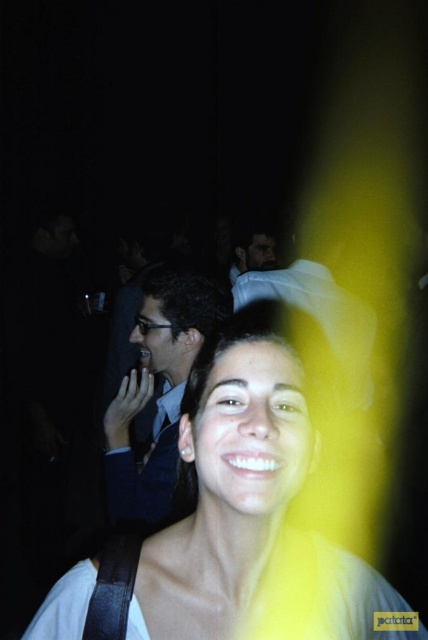
Is white matte face at center in front of matte white shirt at center?

Yes, it is.

Which of these two, white matte face at center or matte white shirt at center, stands taller?

Standing taller between the two is white matte face at center.

The image size is (428, 640). I want to click on white matte face at center, so click(x=231, y=522).

Consider the image. Between white matte face at center and matte black suit at center, which one appears on the left side from the viewer's perspective?

From the viewer's perspective, matte black suit at center appears more on the left side.

Is white matte face at center behind matte black suit at center?

No, white matte face at center is closer to the viewer.

At what (x,y) coordinates should I click in order to perform the action: click on white matte face at center. Please return your answer as a coordinate pair (x, y). Looking at the image, I should click on (231, 522).

Does matte black suit at center have a larger size compared to matte white shirt at center?

Indeed, matte black suit at center has a larger size compared to matte white shirt at center.

Identify the location of matte black suit at center. (152, 392).

Locate an element on the screen. Image resolution: width=428 pixels, height=640 pixels. matte black suit at center is located at coordinates (152, 392).